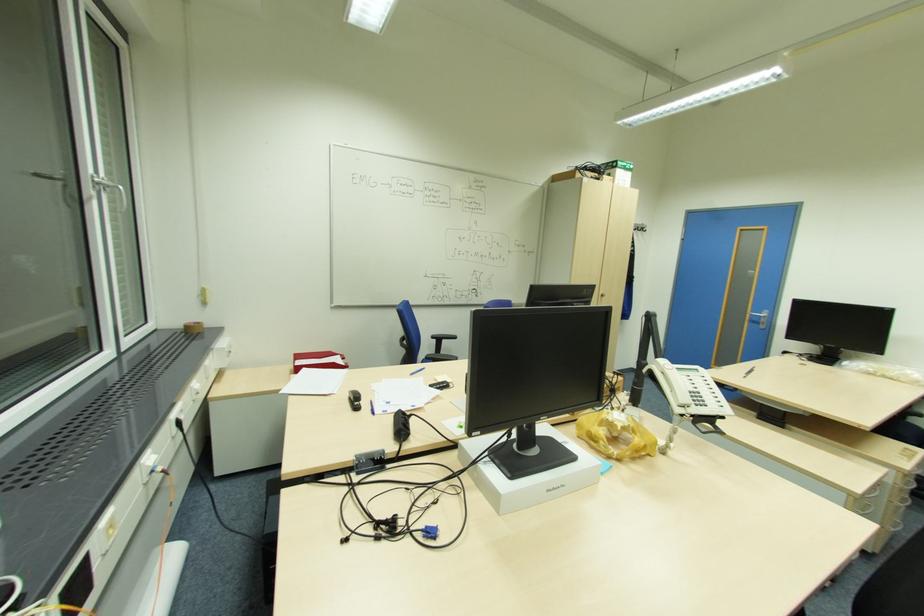
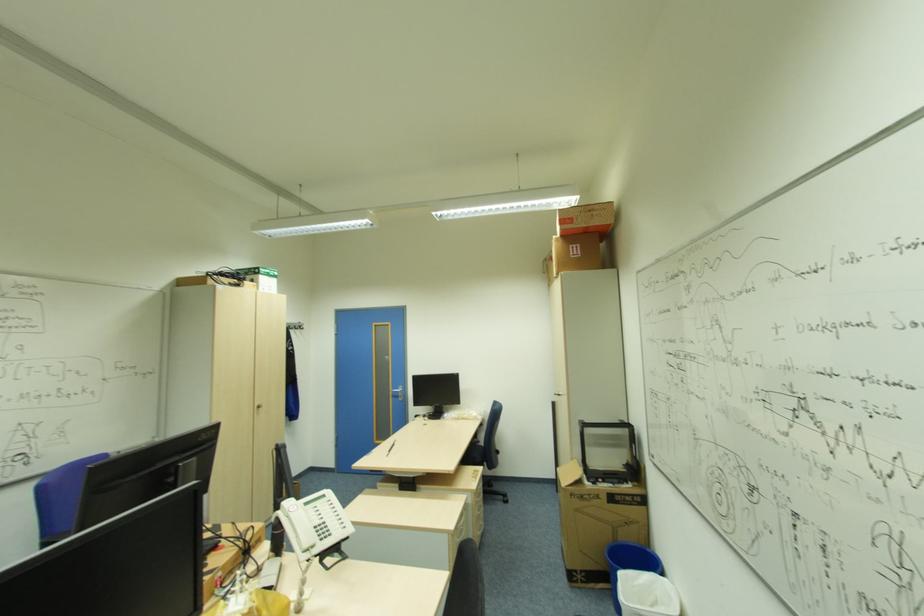
Question: Based on the continuous images, in which direction is the camera rotating? Reply with the corresponding letter.

Choices:
 (A) Left
 (B) Right
 (C) Up
 (D) Down

Answer: (B)